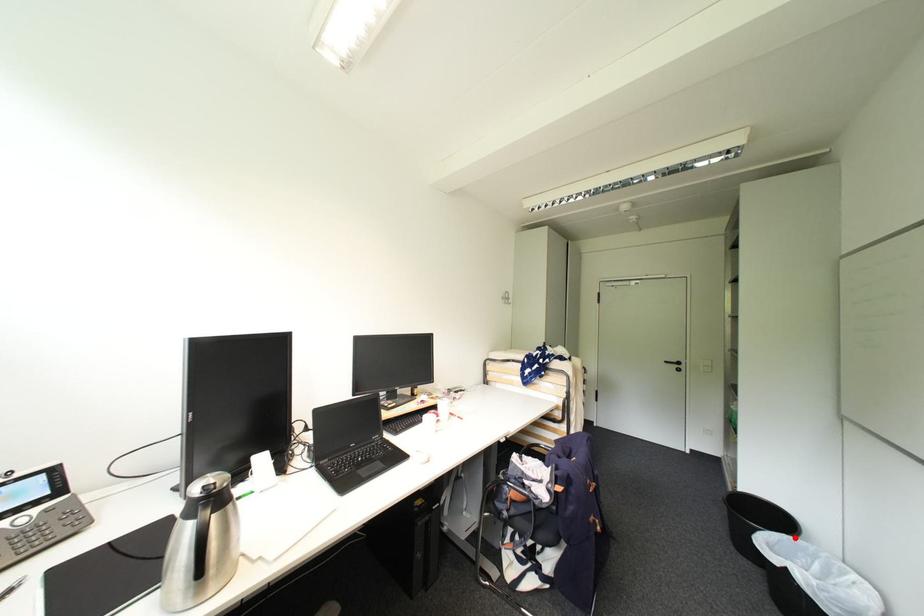
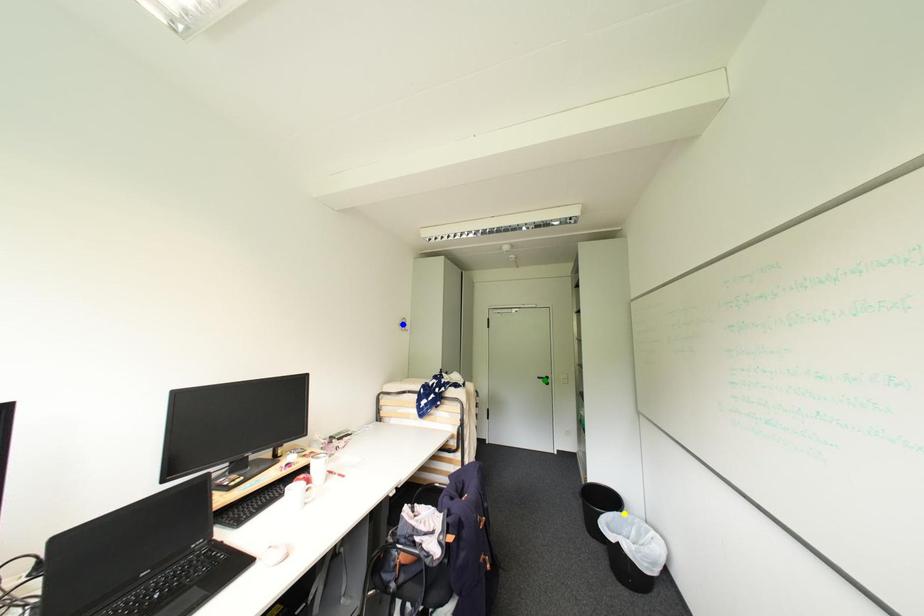
Question: I am providing you with two images of the same scene from different viewpoints. A red point is marked on the first image. You are given multiple points on the second image. In image 2, which mark is for the same physical point as the one in image 1?

Choices:
 (A) yellow point
 (B) blue point
 (C) green point

Answer: (A)